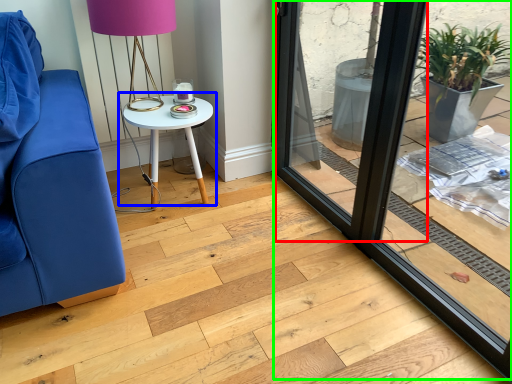
Question: Considering the real-world distances, which object is farthest from screen door (highlighted by a red box)? table (highlighted by a blue box) or window frame (highlighted by a green box)?

Choices:
 (A) table
 (B) window frame

Answer: (A)